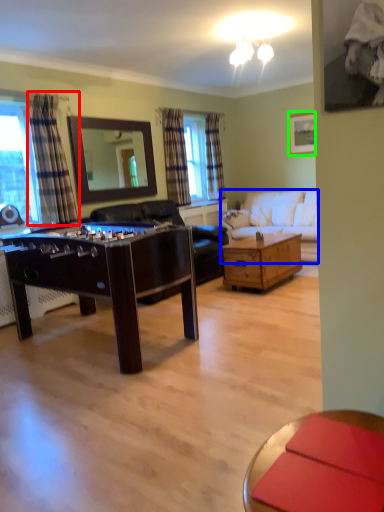
Question: Which object is the farthest from curtain (highlighted by a red box)? Choose among these: studio couch (highlighted by a blue box) or picture frame (highlighted by a green box).

Choices:
 (A) studio couch
 (B) picture frame

Answer: (B)